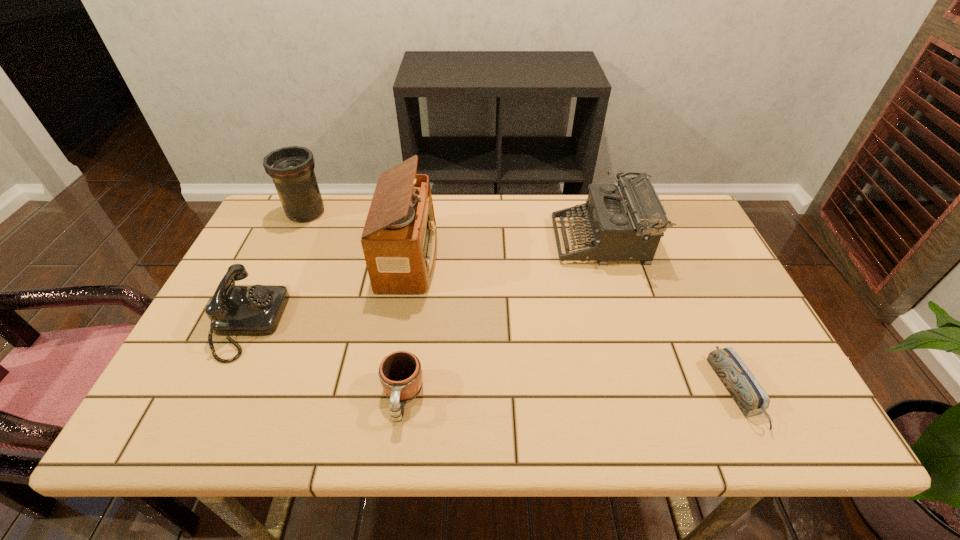
Locate an element on the screen. This screenshot has height=540, width=960. the tallest object is located at coordinates (399, 240).

The width and height of the screenshot is (960, 540). Find the location of `telephoto lens`. telephoto lens is located at coordinates (292, 168).

At what (x,y) coordinates should I click in order to perform the action: click on the fifth object from left to right. Please return your answer as a coordinate pair (x, y). Looking at the image, I should click on (626, 221).

In order to click on telephone in this screenshot , I will do `click(234, 310)`.

The width and height of the screenshot is (960, 540). Identify the location of mug. (400, 373).

Locate an element on the screen. pencil box is located at coordinates (750, 397).

In order to click on the shortest object in this screenshot , I will do `click(750, 397)`.

Identify the location of vacant point located 0.170m on the front panel of the tallest object. Image resolution: width=960 pixels, height=540 pixels. (496, 258).

At what (x,y) coordinates should I click in order to perform the action: click on vacant space located 0.290m on the right of the telephoto lens. Please return your answer as a coordinate pair (x, y). The height and width of the screenshot is (540, 960). Looking at the image, I should click on (420, 212).

The image size is (960, 540). I want to click on free location located on the typing side of the typewriter, so click(453, 241).